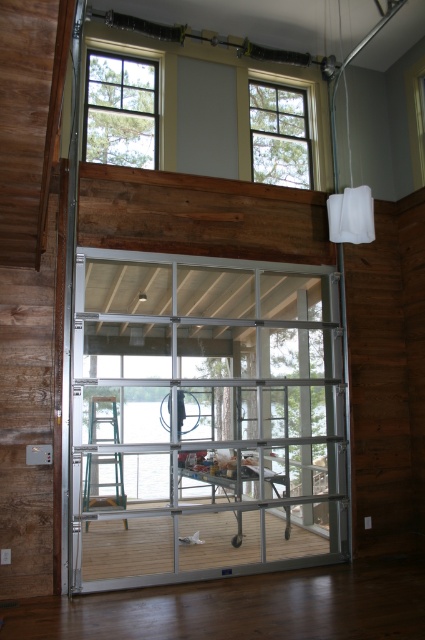
You are standing inside the room and want to look out through the clear glass window at upper left. Which window should you look above or below to find the clear glass window at upper center?

The clear glass window at upper left is located above the clear glass window at upper center, so to find the clear glass window at upper center, you should look below the clear glass window at upper left.

You are standing inside the room and want to exit to the deck outside. The clear glass door at center is partially open. Is the green plastic ladder at lower left blocking your path to the door?

The clear glass door at center is positioned under the green plastic ladder at lower left, so the ladder is above the door and not blocking the path to it.

You are an interior designer assessing the lighting in this room. You notice two clear glass windows, the clear glass window at upper left and the clear glass window at upper center. Which window allows more natural light into the room based on their heights?

The clear glass window at upper center allows more natural light into the room because it has a greater height compared to the clear glass window at upper left.